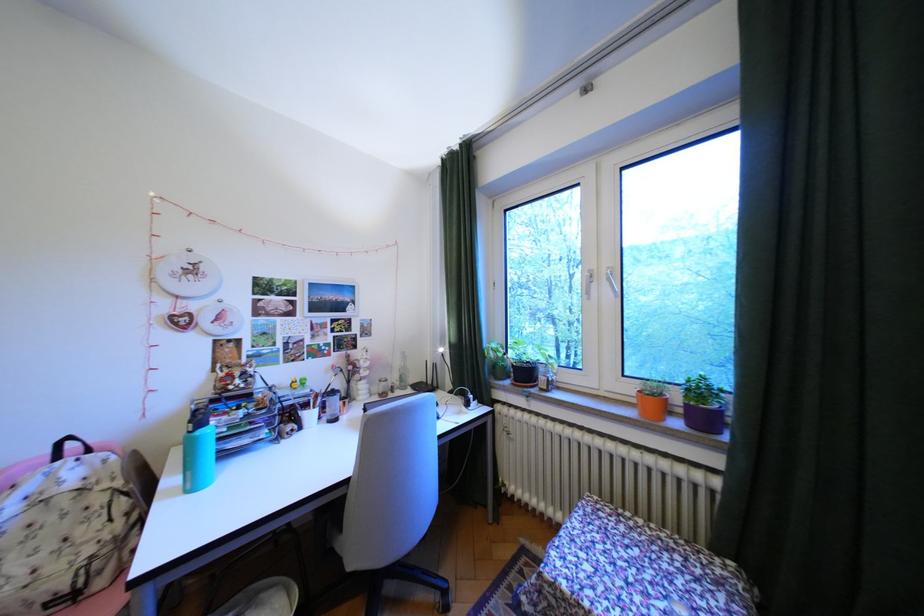
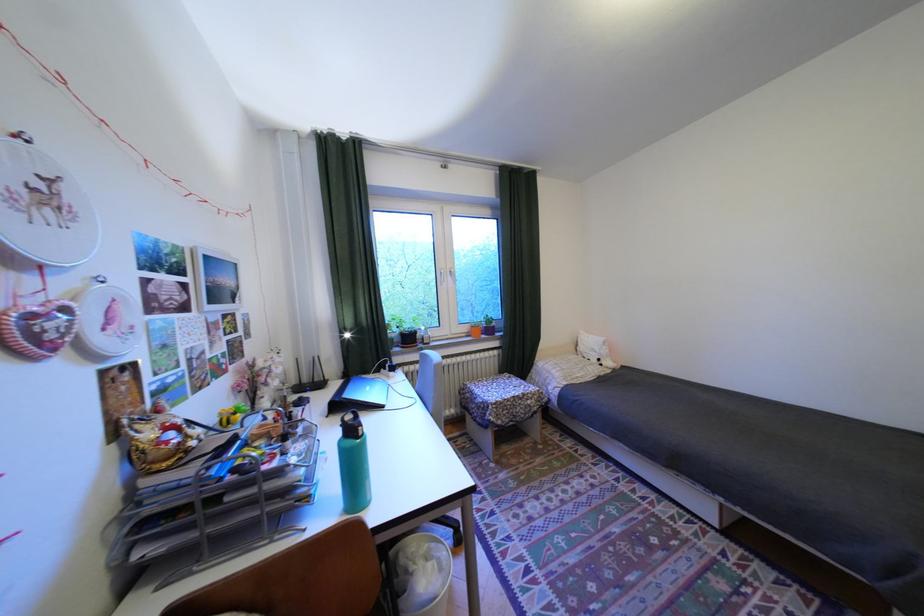
The point at [601,299] is marked in the first image. Where is the corresponding point in the second image?

(454, 285)